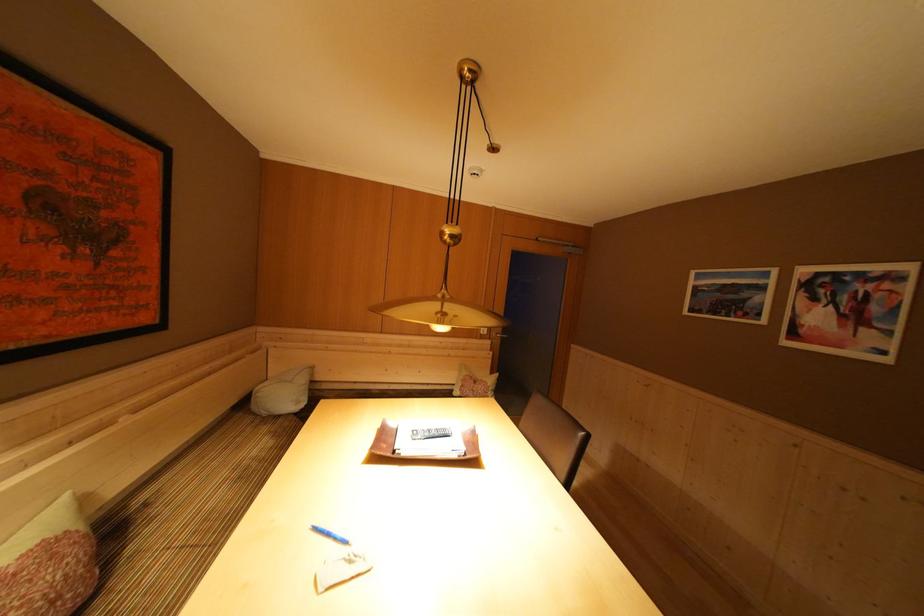
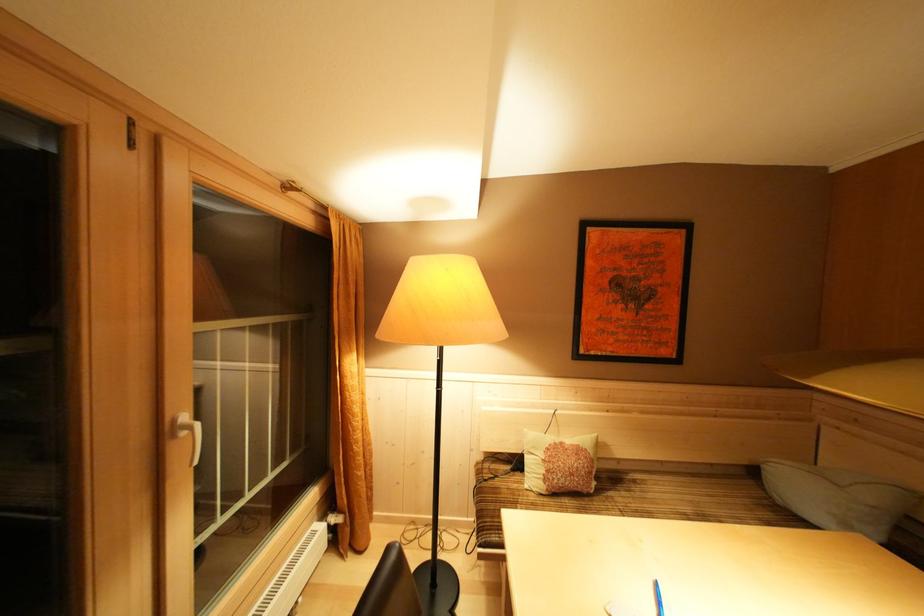
Question: The images are taken continuously from a first-person perspective. In which direction is your viewpoint rotating?

Choices:
 (A) Left
 (B) Right
 (C) Up
 (D) Down

Answer: (A)